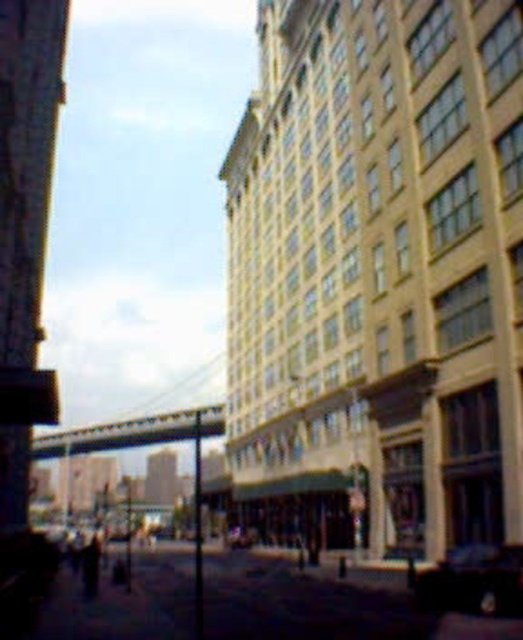
You are a delivery person who needs to park your delivery van, which is 1.8 meters tall, in the parking lot behind the building. The parking spots are between the shiny black car at lower right and the shiny silver car at center. Can your van fit between them vertically?

The shiny black car at lower right is taller than the shiny silver car at center. Since the tallest object between them is the shiny black car at lower right, and its height is not specified, but the van is 1.8 meters tall, it is uncertain if there is enough vertical clearance. However, since the question only provides relative height information, we cannot definitively confirm if the van will fit. Please check the actual heights.

You are standing at the lamppost near the center of the street and want to walk to the shiny silver car at center. Which direction should you go to avoid the shiny black car at lower right?

Since the shiny black car at lower right is to the right of the shiny silver car at center, you should walk to the left to reach the shiny silver car at center without going near the shiny black car at lower right.

You are a pedestrian standing on the sidewalk looking at the street. You see a shiny black car at lower right and a shiny silver car at center. Which car is closer to you?

The shiny black car at lower right is closer to you because it is in front of the shiny silver car at center.